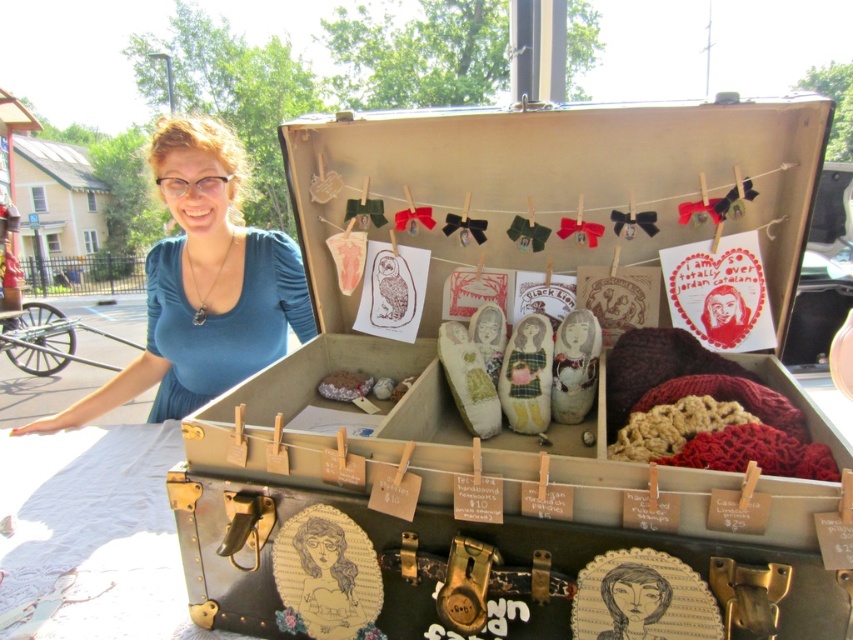
Is brushed metal cart at left wider than black paper at center?

Indeed, brushed metal cart at left has a greater width compared to black paper at center.

Does point (3, 342) come closer to viewer compared to point (618, 630)?

No, it is behind (618, 630).

Image resolution: width=853 pixels, height=640 pixels. I want to click on brushed metal cart at left, so click(x=45, y=339).

Is metallic suitcase at center below brushed metal cart at left?

No.

Can you confirm if metallic suitcase at center is shorter than brushed metal cart at left?

Indeed, metallic suitcase at center has a lesser height compared to brushed metal cart at left.

Where is `metallic suitcase at center`? The width and height of the screenshot is (853, 640). metallic suitcase at center is located at coordinates (526, 412).

Between teal fabric at left and brushed metal cart at left, which one appears on the left side from the viewer's perspective?

brushed metal cart at left

I want to click on teal fabric at left, so click(x=202, y=284).